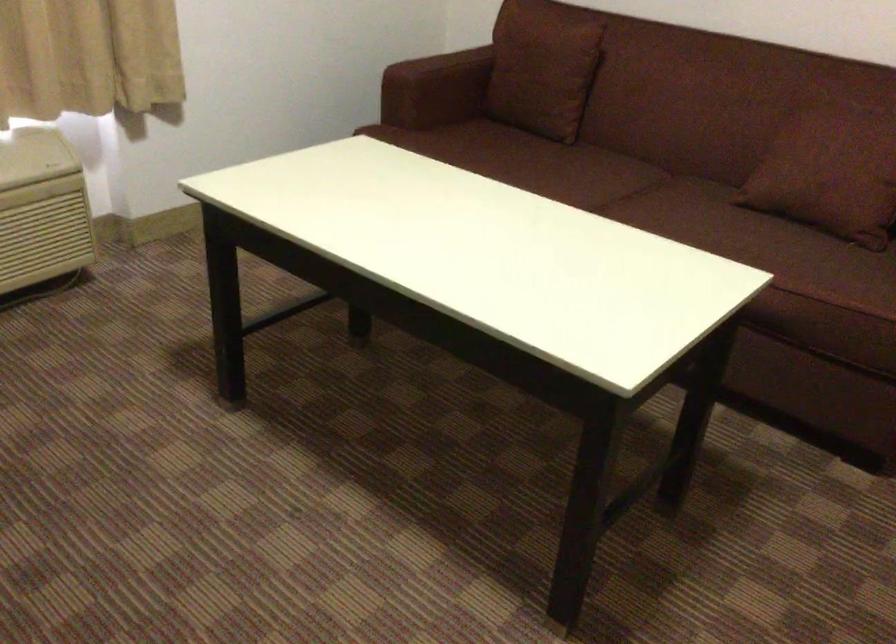
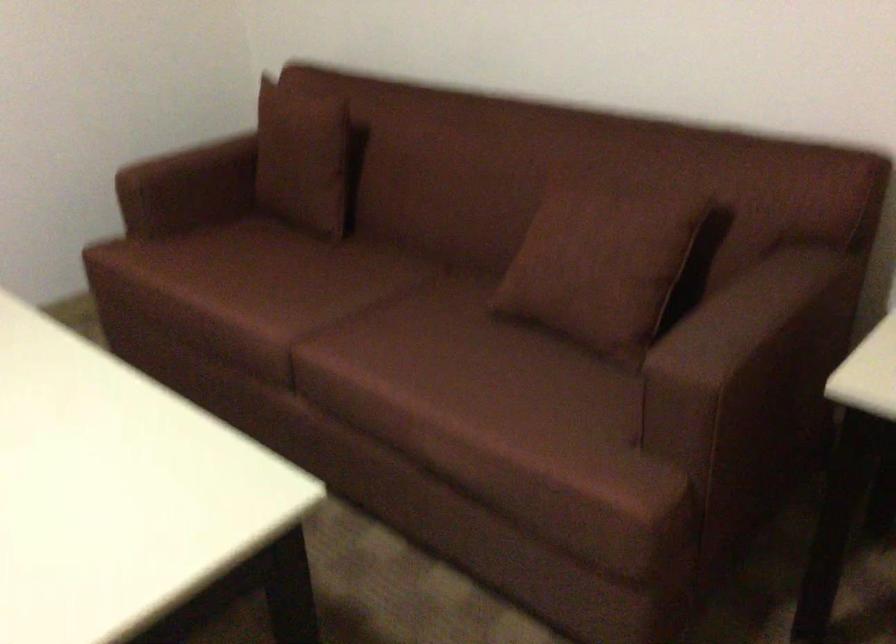
The point at (547, 167) is marked in the first image. Where is the corresponding point in the second image?

(286, 283)